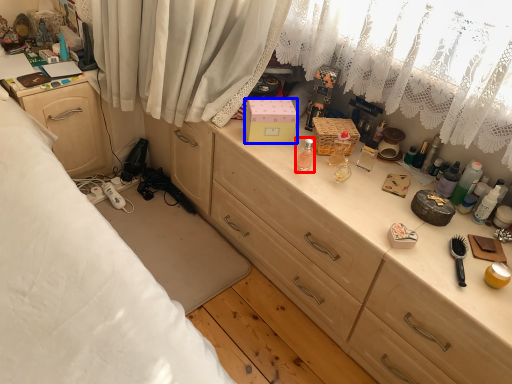
Question: Which point is closer to the camera, toiletry (highlighted by a red box) or box (highlighted by a blue box)?

Choices:
 (A) toiletry
 (B) box

Answer: (A)